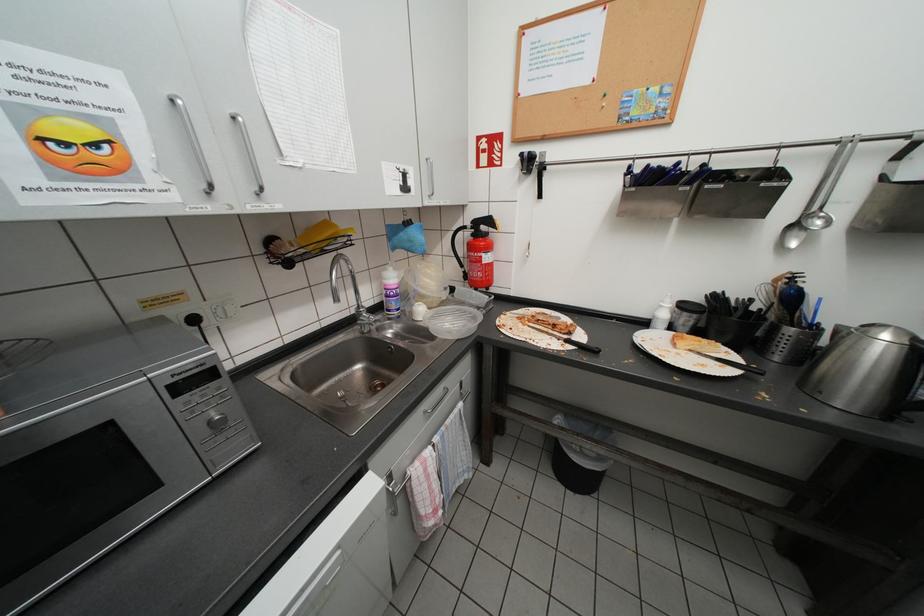
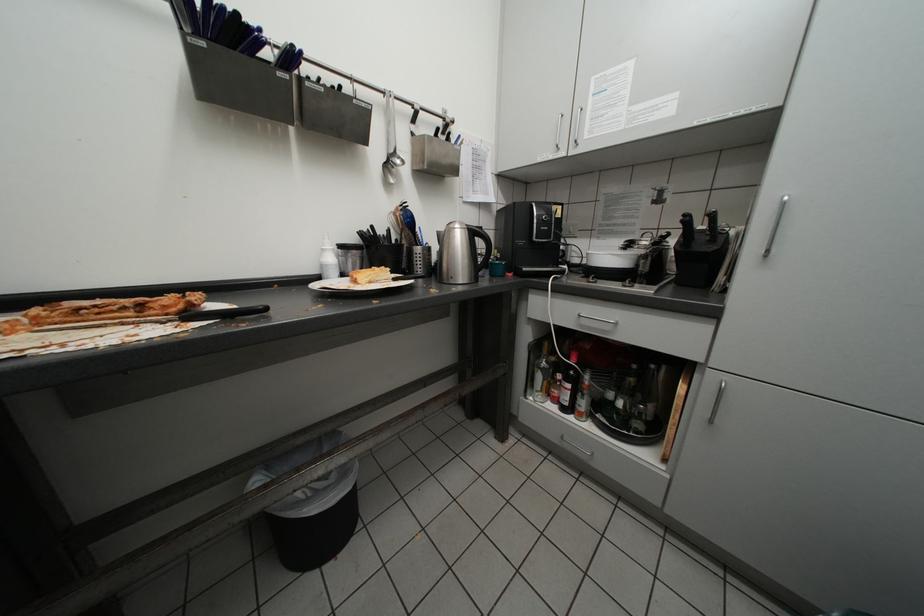
Question: The camera is either moving clockwise (left) or counter-clockwise (right) around the object. The first image is from the beginning of the video and the second image is from the end. Is the camera moving left or right when shooting the video?

Choices:
 (A) Left
 (B) Right

Answer: (A)